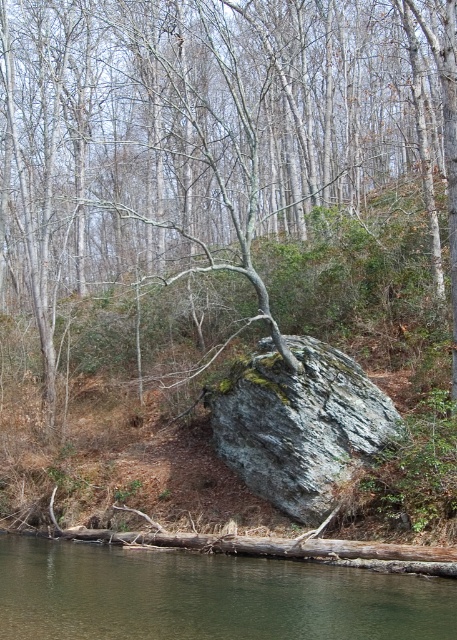
Who is shorter, green mossy rock at center or clear water at lower center?

clear water at lower center is shorter.

Who is more forward, (258, 232) or (168, 589)?

Point (168, 589)

Between point (134, 84) and point (113, 596), which one is positioned behind?

Positioned behind is point (134, 84).

Identify the location of green mossy rock at center. The height and width of the screenshot is (640, 457). (210, 134).

Is green mossy rock at center positioned behind gray rough boulder at center?

No.

Is point (205, 116) less distant than point (292, 417)?

No, it is behind (292, 417).

Locate an element on the screen. This screenshot has height=640, width=457. green mossy rock at center is located at coordinates (210, 134).

Is clear water at lower center thinner than gray rough boulder at center?

In fact, clear water at lower center might be wider than gray rough boulder at center.

Is clear water at lower center further to camera compared to gray rough boulder at center?

No, clear water at lower center is closer to the viewer.

Between point (166, 636) and point (367, 458), which one is positioned in front?

Positioned in front is point (166, 636).

Locate an element on the screen. This screenshot has width=457, height=640. clear water at lower center is located at coordinates (207, 596).